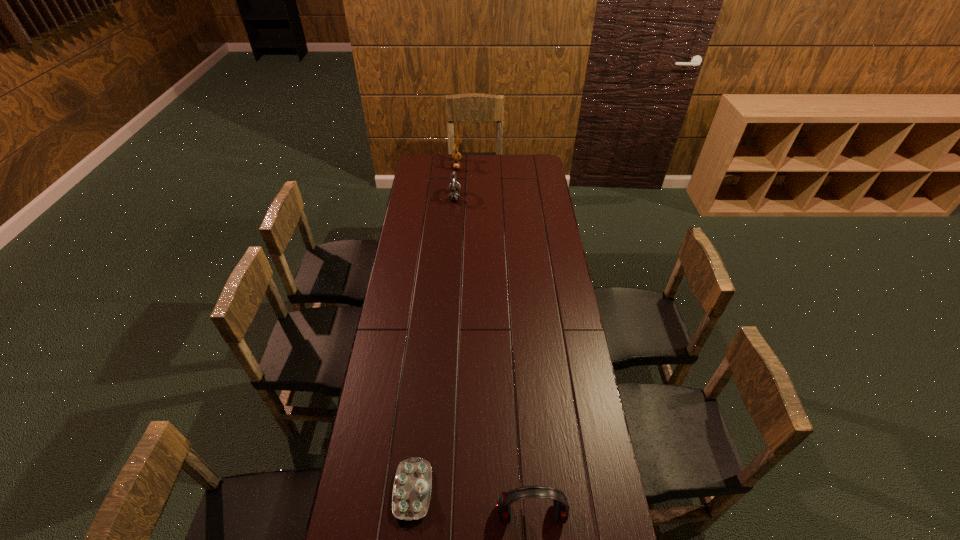
You are a GUI agent. You are given a task and a screenshot of the screen. Output one action in this format:
    pyautogui.click(x=<x>, y=<y>)
    Task: Click on the free space between the nearest earphone and the chinaware
    
    Given the screenshot: What is the action you would take?
    pyautogui.click(x=472, y=502)

This screenshot has height=540, width=960. I want to click on vacant space that is in between the third nearest object and the nearest earphone, so click(x=493, y=355).

This screenshot has width=960, height=540. In order to click on vacant area between the second farthest object and the nearest earphone in this screenshot , I will do `click(493, 355)`.

Select which object is the closest to the rightmost object. Please provide its 2D coordinates. Your answer should be formatted as a tuple, i.e. [(x, y)], where the tuple contains the x and y coordinates of a point satisfying the conditions above.

[(412, 486)]

What are the coordinates of `object that is the second closest one to the second farthest object` in the screenshot? It's located at (412, 486).

Choose which earphone is the second nearest neighbor to the farthest object. Please provide its 2D coordinates. Your answer should be formatted as a tuple, i.e. [(x, y)], where the tuple contains the x and y coordinates of a point satisfying the conditions above.

[(561, 506)]

Locate which earphone is the closest to the nearest earphone. Please provide its 2D coordinates. Your answer should be formatted as a tuple, i.e. [(x, y)], where the tuple contains the x and y coordinates of a point satisfying the conditions above.

[(454, 188)]

Where is `free location that satisfies the following two spatial constraints: 1. on the front-facing side of the farthest object; 2. on the front side of the chinaware`? The height and width of the screenshot is (540, 960). free location that satisfies the following two spatial constraints: 1. on the front-facing side of the farthest object; 2. on the front side of the chinaware is located at coordinates (434, 490).